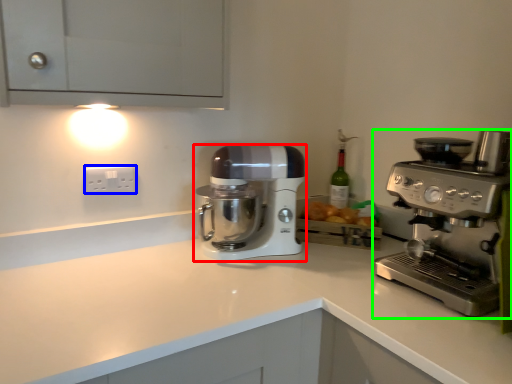
Question: Estimate the real-world distances between objects in this image. Which object is farther from mixer (highlighted by a red box), electric outlet (highlighted by a blue box) or coffee maker (highlighted by a green box)?

Choices:
 (A) electric outlet
 (B) coffee maker

Answer: (B)